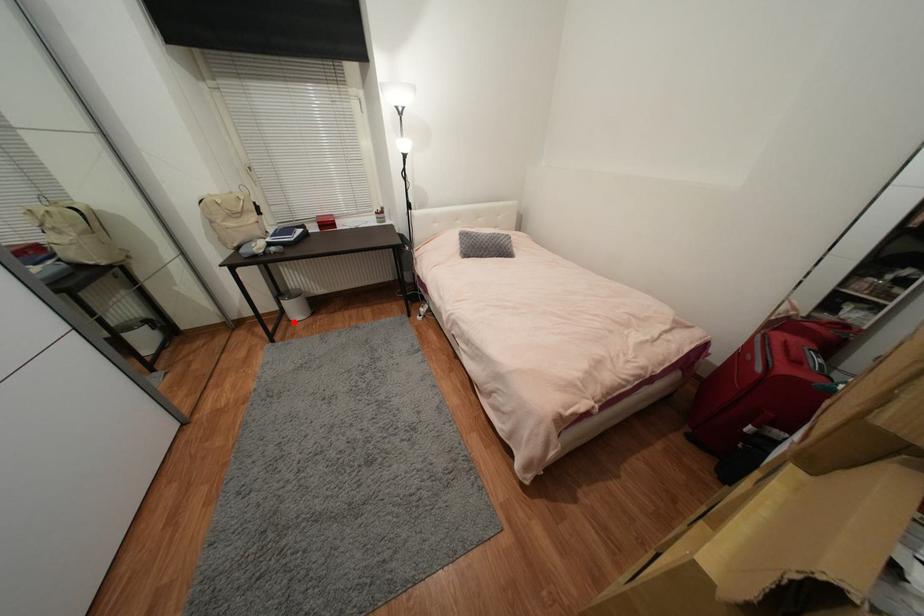
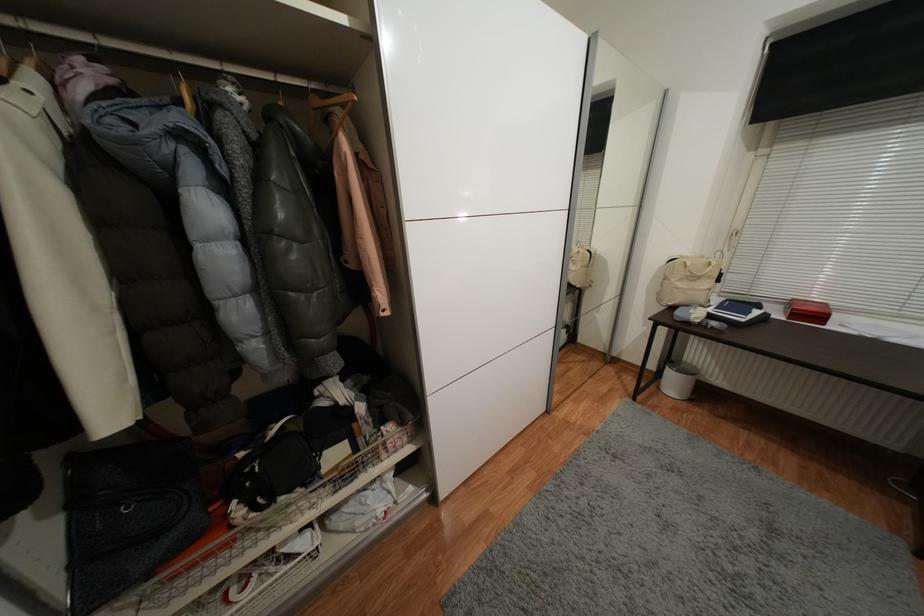
In the second image, find the point that corresponds to the highlighted location in the first image.

(663, 390)